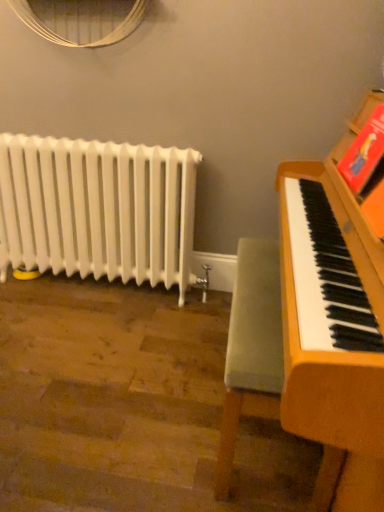
Identify the location of velvet green armchair at right. This screenshot has height=512, width=384. (251, 348).

What is the approximate width of velvet green armchair at right?

velvet green armchair at right is 13.47 inches in width.

Describe the element at coordinates (251, 348) in the screenshot. I see `velvet green armchair at right` at that location.

The height and width of the screenshot is (512, 384). In order to click on white glossy radiator at left in this screenshot , I will do `click(98, 209)`.

The image size is (384, 512). What do you see at coordinates (98, 209) in the screenshot?
I see `white glossy radiator at left` at bounding box center [98, 209].

This screenshot has height=512, width=384. Find the location of `velvet green armchair at right`. velvet green armchair at right is located at coordinates (251, 348).

Visually, is velvet green armchair at right positioned to the left or to the right of white glossy radiator at left?

Clearly, velvet green armchair at right is on the right of white glossy radiator at left in the image.

Is velvet green armchair at right in front of or behind white glossy radiator at left in the image?

velvet green armchair at right is positioned closer to the viewer than white glossy radiator at left.

Between point (245, 256) and point (188, 253), which one is positioned behind?

The point (188, 253) is farther from the camera.

From the image's perspective, is velvet green armchair at right located above or below white glossy radiator at left?

velvet green armchair at right is situated lower than white glossy radiator at left in the image.

From a real-world perspective, which is physically above, velvet green armchair at right or white glossy radiator at left?

In real-world perspective, white glossy radiator at left is above.

Which object is wider, velvet green armchair at right or white glossy radiator at left?

Wider between the two is velvet green armchair at right.

Consider the image. From their relative heights in the image, would you say velvet green armchair at right is taller or shorter than white glossy radiator at left?

Clearly, velvet green armchair at right is shorter compared to white glossy radiator at left.

Is velvet green armchair at right bigger than white glossy radiator at left?

No, velvet green armchair at right is not bigger than white glossy radiator at left.

Is white glossy radiator at left a part of velvet green armchair at right?

Actually, white glossy radiator at left is outside velvet green armchair at right.

Is the surface of velvet green armchair at right in direct contact with white glossy radiator at left?

No, velvet green armchair at right is not beside white glossy radiator at left.

Is velvet green armchair at right aimed at white glossy radiator at left?

Yes, velvet green armchair at right is aimed at white glossy radiator at left.

Locate an element on the screen. armchair on the right of white glossy radiator at left is located at coordinates (251, 348).

Which is more to the right, white glossy radiator at left or velvet green armchair at right?

velvet green armchair at right.

Which object is closer to the camera, white glossy radiator at left or velvet green armchair at right?

velvet green armchair at right is in front.

Is point (53, 263) closer or farther from the camera than point (248, 389)?

Point (53, 263).

From the image's perspective, which object appears higher, white glossy radiator at left or velvet green armchair at right?

From the image's view, white glossy radiator at left is above.

From a real-world perspective, who is located higher, white glossy radiator at left or velvet green armchair at right?

white glossy radiator at left is physically above.

Considering the sizes of white glossy radiator at left and velvet green armchair at right in the image, is white glossy radiator at left wider or thinner than velvet green armchair at right?

white glossy radiator at left is thinner than velvet green armchair at right.

From their relative heights in the image, would you say white glossy radiator at left is taller or shorter than velvet green armchair at right?

In the image, white glossy radiator at left appears to be taller than velvet green armchair at right.

Which of these two, white glossy radiator at left or velvet green armchair at right, is bigger?

white glossy radiator at left.

Is white glossy radiator at left situated inside velvet green armchair at right or outside?

white glossy radiator at left lies outside velvet green armchair at right.

Looking at this image, is white glossy radiator at left touching velvet green armchair at right?

No, white glossy radiator at left is not next to velvet green armchair at right.

From the picture: Is white glossy radiator at left facing away from velvet green armchair at right?

No, white glossy radiator at left is not facing the opposite direction of velvet green armchair at right.

You are a GUI agent. You are given a task and a screenshot of the screen. Output one action in this format:
    pyautogui.click(x=<x>, y=<y>)
    Task: Click on the armchair that is below the white glossy radiator at left (from the image's perspective)
    
    Given the screenshot: What is the action you would take?
    pyautogui.click(x=251, y=348)

The image size is (384, 512). I want to click on radiator above the velvet green armchair at right (from a real-world perspective), so click(x=98, y=209).

Where is `armchair that appears below the white glossy radiator at left (from a real-world perspective)`? This screenshot has height=512, width=384. armchair that appears below the white glossy radiator at left (from a real-world perspective) is located at coordinates (251, 348).